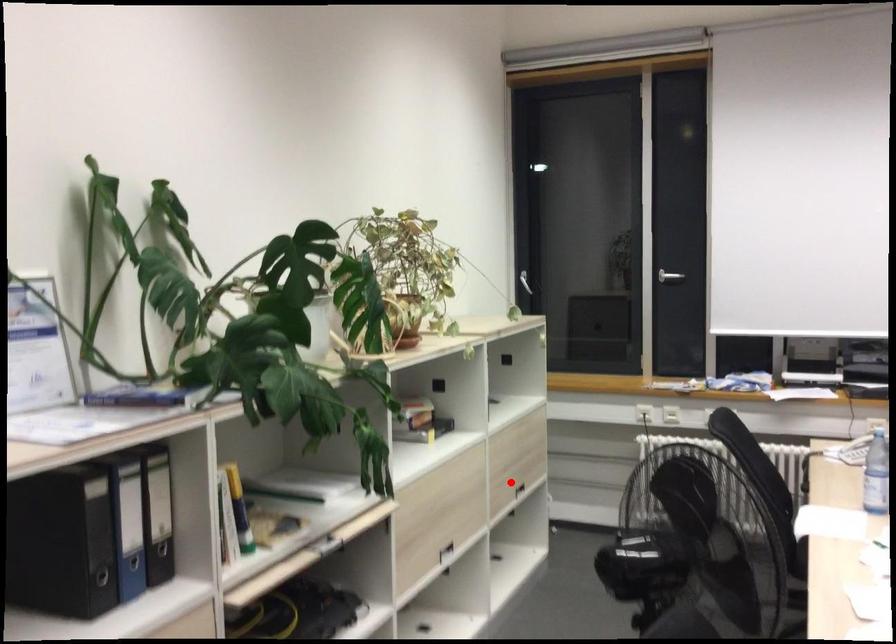
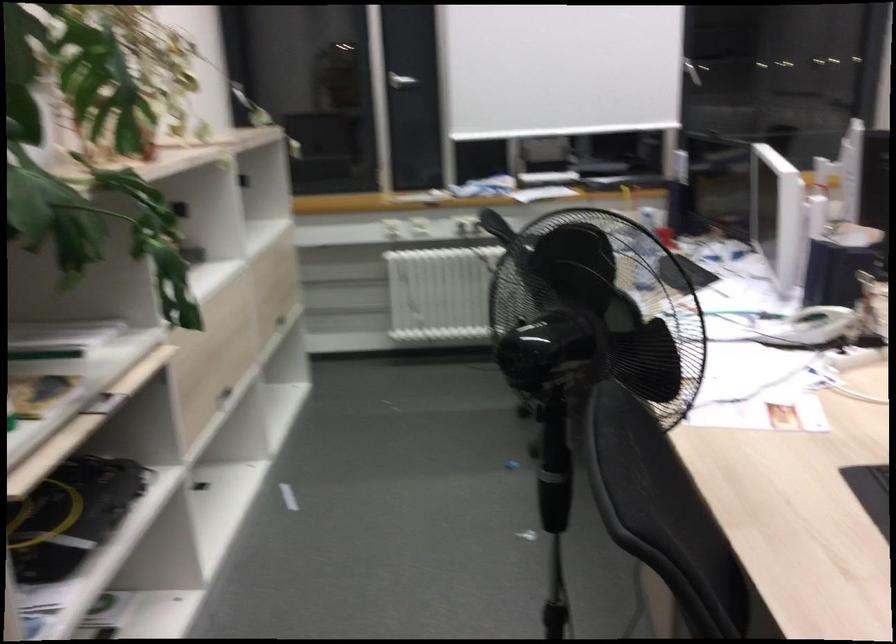
In the second image, find the point that corresponds to the highlighted location in the first image.

(276, 313)